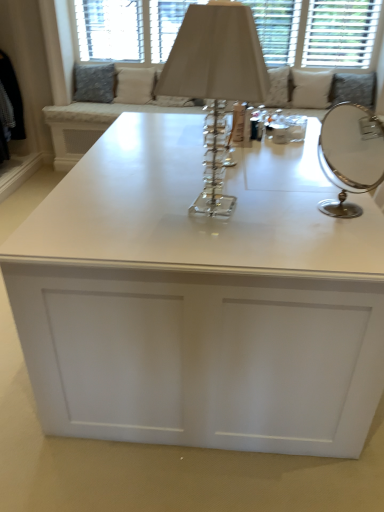
Locate an element on the screen. The height and width of the screenshot is (512, 384). white glossy table at center is located at coordinates (200, 298).

This screenshot has width=384, height=512. Describe the element at coordinates (200, 298) in the screenshot. I see `white glossy table at center` at that location.

Consider the image. How much space does beige fabric pillow at upper center, positioned as the 2th pillow in right-to-left order, occupy vertically?

beige fabric pillow at upper center, positioned as the 2th pillow in right-to-left order, is 14.73 inches in height.

How much space does beige fabric pillow at upper center, positioned as the 2th pillow in right-to-left order, occupy horizontally?

beige fabric pillow at upper center, positioned as the 2th pillow in right-to-left order, is 8.71 inches wide.

Describe the element at coordinates (216, 82) in the screenshot. I see `clear crystal table lamp at center` at that location.

At what (x,y) coordinates should I click in order to perform the action: click on textured gray pillow at upper left, which is counted as the 3th pillow, starting from the right. Please return your answer as a coordinate pair (x, y). The width and height of the screenshot is (384, 512). Looking at the image, I should click on (94, 83).

Find the location of a particular element. The width and height of the screenshot is (384, 512). silver/metallic round mirror at right is located at coordinates pyautogui.click(x=350, y=155).

Locate an element on the screen. table located in front of the white fabric pillow at upper right, acting as the 1th pillow starting from the right is located at coordinates (200, 298).

Is white fabric pillow at upper right, which appears as the 3th pillow when viewed from the left, to the left or to the right of white glossy table at center in the image?

Clearly, white fabric pillow at upper right, which appears as the 3th pillow when viewed from the left, is on the right of white glossy table at center in the image.

From the image's perspective, is white fabric pillow at upper right, acting as the 1th pillow starting from the right, located above or below white glossy table at center?

white fabric pillow at upper right, acting as the 1th pillow starting from the right, is above white glossy table at center.

In the image, is white glossy table at center on the left side or the right side of clear crystal table lamp at center?

Clearly, white glossy table at center is on the left of clear crystal table lamp at center in the image.

Considering the sizes of objects white glossy table at center and clear crystal table lamp at center in the image provided, who is taller, white glossy table at center or clear crystal table lamp at center?

With more height is clear crystal table lamp at center.

Between white glossy table at center and clear crystal table lamp at center, which one has larger size?

Bigger between the two is white glossy table at center.

In the scene shown: Does white glossy table at center have a lesser width compared to clear crystal table lamp at center?

No, white glossy table at center is not thinner than clear crystal table lamp at center.

Looking at their sizes, would you say white fabric cushion at upper center is wider or thinner than white fabric pillow at upper right, which appears as the 3th pillow when viewed from the left?

Considering their sizes, white fabric cushion at upper center looks slimmer than white fabric pillow at upper right, which appears as the 3th pillow when viewed from the left.

Which is more to the right, white fabric cushion at upper center or white fabric pillow at upper right, acting as the 1th pillow starting from the right?

From the viewer's perspective, white fabric pillow at upper right, acting as the 1th pillow starting from the right, appears more on the right side.

Does white fabric cushion at upper center have a smaller size compared to white fabric pillow at upper right, which appears as the 3th pillow when viewed from the left?

No, white fabric cushion at upper center is not smaller than white fabric pillow at upper right, which appears as the 3th pillow when viewed from the left.

Locate an element on the screen. This screenshot has width=384, height=512. bay window above the white fabric pillow at upper right, which appears as the 3th pillow when viewed from the left (from a real-world perspective) is located at coordinates (317, 32).

Is white fabric cushion at upper center at the right side of textured gray pillow at upper left, which is counted as the first pillow, starting from the left?

Indeed, white fabric cushion at upper center is positioned on the right side of textured gray pillow at upper left, which is counted as the first pillow, starting from the left.

Which is behind, point (263, 26) or point (115, 74)?

The point (115, 74) is farther.

Locate an element on the screen. The height and width of the screenshot is (512, 384). the 2nd pillow directly beneath the white fabric cushion at upper center (from a real-world perspective) is located at coordinates (94, 83).

From a real-world perspective, is clear crystal table lamp at center located beneath beige fabric pillow at upper center, positioned as the 2th pillow in right-to-left order?

No, from a real-world perspective, clear crystal table lamp at center is not below beige fabric pillow at upper center, positioned as the 2th pillow in right-to-left order.

Does point (222, 51) appear closer or farther from the camera than point (128, 78)?

Point (222, 51).

Is clear crystal table lamp at center bigger or smaller than beige fabric pillow at upper center, positioned as the 2th pillow in right-to-left order?

Clearly, clear crystal table lamp at center is larger in size than beige fabric pillow at upper center, positioned as the 2th pillow in right-to-left order.

In the scene shown: Can you tell me how much clear crystal table lamp at center and beige fabric pillow at upper center, arranged as the 2th pillow when viewed from the left, differ in facing direction?

99.5 degrees.

What's the angular difference between textured gray pillow at upper left, which is counted as the first pillow, starting from the left, and silver/metallic round mirror at right's facing directions?

There is a 126-degree angle between the facing directions of textured gray pillow at upper left, which is counted as the first pillow, starting from the left, and silver/metallic round mirror at right.

Find the location of a particular element. The width and height of the screenshot is (384, 512). mirror that appears above the textured gray pillow at upper left, which is counted as the 3th pillow, starting from the right (from a real-world perspective) is located at coordinates (350, 155).

Between textured gray pillow at upper left, which is counted as the first pillow, starting from the left, and silver/metallic round mirror at right, which one is positioned behind?

textured gray pillow at upper left, which is counted as the first pillow, starting from the left.

Is textured gray pillow at upper left, which is counted as the 3th pillow, starting from the right, facing away from silver/metallic round mirror at right?

No, textured gray pillow at upper left, which is counted as the 3th pillow, starting from the right, is not facing the opposite direction of silver/metallic round mirror at right.

Considering the points (186, 1) and (211, 8), which point is in front, point (186, 1) or point (211, 8)?

The point (211, 8) is closer.

Can you confirm if white fabric cushion at upper center is shorter than clear crystal table lamp at center?

No.

This screenshot has width=384, height=512. I want to click on table that is on the left side of white fabric pillow at upper right, acting as the 1th pillow starting from the right, so click(x=200, y=298).

This screenshot has height=512, width=384. I want to click on table lamp above the white glossy table at center (from the image's perspective), so click(216, 82).

Looking at the image, which one is located further to white fabric cushion at upper center, silver/metallic round mirror at right or white glossy table at center?

Among the two, white glossy table at center is located further to white fabric cushion at upper center.

Consider the image. Looking at the image, which one is located closer to silver/metallic round mirror at right, textured gray pillow at upper left, which is counted as the first pillow, starting from the left, or beige fabric pillow at upper center, arranged as the 2th pillow when viewed from the left?

Among the two, beige fabric pillow at upper center, arranged as the 2th pillow when viewed from the left, is located nearer to silver/metallic round mirror at right.

Estimate the real-world distances between objects in this image. Which object is further from clear crystal table lamp at center, white glossy table at center or white fabric cushion at upper center?

white fabric cushion at upper center is positioned further to the anchor clear crystal table lamp at center.

When comparing their distances from beige fabric pillow at upper center, positioned as the 2th pillow in right-to-left order, does white fabric pillow at upper right, which appears as the 3th pillow when viewed from the left, or textured gray pillow at upper left, which is counted as the first pillow, starting from the left, seem further?

white fabric pillow at upper right, which appears as the 3th pillow when viewed from the left, lies further to beige fabric pillow at upper center, positioned as the 2th pillow in right-to-left order, than the other object.

Estimate the real-world distances between objects in this image. Which object is further from white glossy table at center, textured gray pillow at upper left, which is counted as the first pillow, starting from the left, or beige fabric pillow at upper center, positioned as the 2th pillow in right-to-left order?

textured gray pillow at upper left, which is counted as the first pillow, starting from the left.

Looking at the image, which one is located further to textured gray pillow at upper left, which is counted as the first pillow, starting from the left, white fabric pillow at upper right, which appears as the 3th pillow when viewed from the left, or beige fabric pillow at upper center, arranged as the 2th pillow when viewed from the left?

white fabric pillow at upper right, which appears as the 3th pillow when viewed from the left, is further to textured gray pillow at upper left, which is counted as the first pillow, starting from the left.

When comparing their distances from white fabric pillow at upper right, which appears as the 3th pillow when viewed from the left, does silver/metallic round mirror at right or white glossy table at center seem closer?

Among the two, silver/metallic round mirror at right is located nearer to white fabric pillow at upper right, which appears as the 3th pillow when viewed from the left.

Looking at the image, which one is located further to white fabric cushion at upper center, white glossy table at center or beige fabric pillow at upper center, positioned as the 2th pillow in right-to-left order?

white glossy table at center.

Where is `table located between clear crystal table lamp at center and beige fabric pillow at upper center, arranged as the 2th pillow when viewed from the left, in the depth direction`? The width and height of the screenshot is (384, 512). table located between clear crystal table lamp at center and beige fabric pillow at upper center, arranged as the 2th pillow when viewed from the left, in the depth direction is located at coordinates [x=200, y=298].

Locate an element on the screen. This screenshot has height=512, width=384. table located between clear crystal table lamp at center and white fabric cushion at upper center in the depth direction is located at coordinates (200, 298).

Where is `table positioned between silver/metallic round mirror at right and white fabric pillow at upper right, which appears as the 3th pillow when viewed from the left, from near to far`? The height and width of the screenshot is (512, 384). table positioned between silver/metallic round mirror at right and white fabric pillow at upper right, which appears as the 3th pillow when viewed from the left, from near to far is located at coordinates (200, 298).

Identify the location of bay window positioned between clear crystal table lamp at center and textured gray pillow at upper left, which is counted as the 3th pillow, starting from the right, from near to far. The width and height of the screenshot is (384, 512). (317, 32).